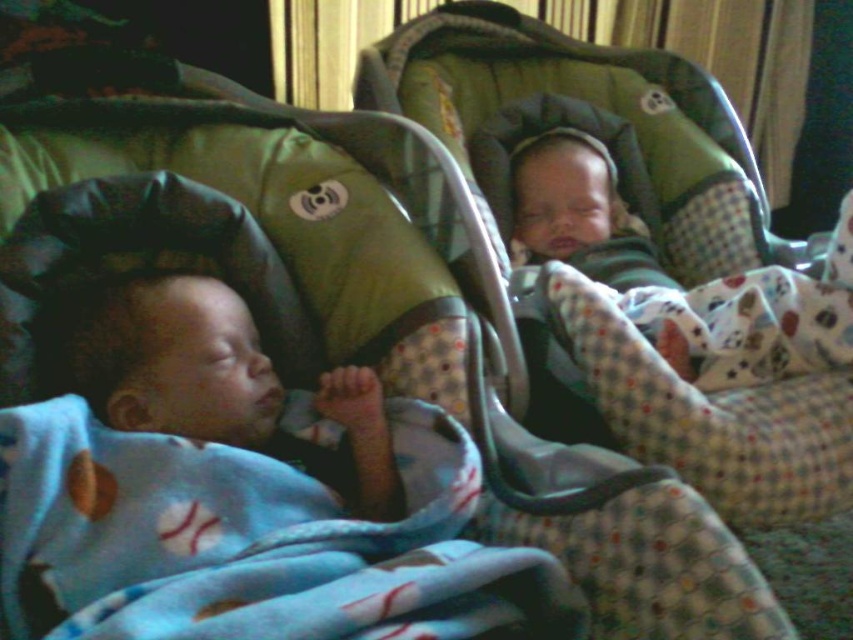
What do you see at coordinates (244, 547) in the screenshot?
I see `blue fleece blanket at lower left` at bounding box center [244, 547].

Is blue fleece blanket at lower left taller than soft blue blanket at left?

In fact, blue fleece blanket at lower left may be shorter than soft blue blanket at left.

Which is in front, point (279, 540) or point (225, 356)?

Point (279, 540) is in front.

Find the location of a particular element. blue fleece blanket at lower left is located at coordinates 244,547.